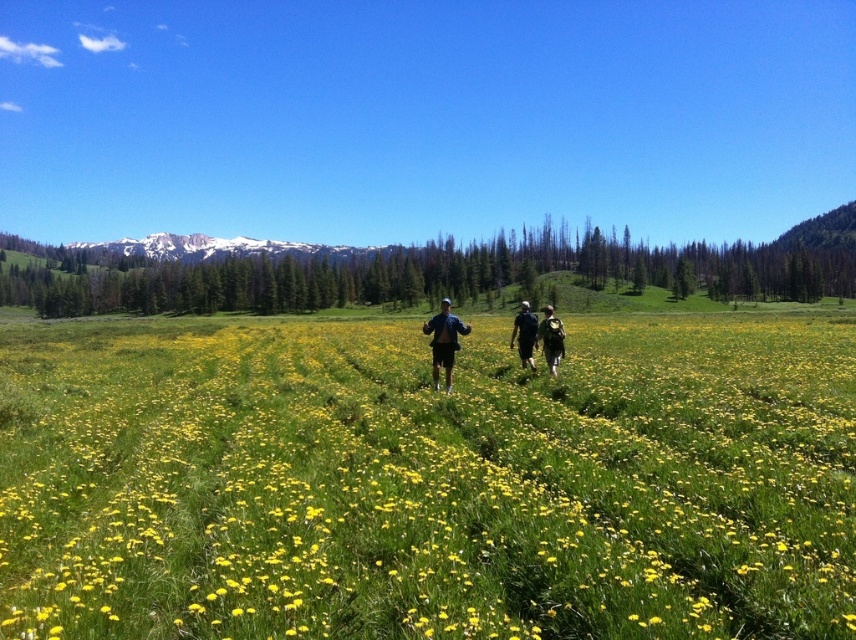
Image resolution: width=856 pixels, height=640 pixels. In order to click on yellow grass at center in this screenshot , I will do `click(428, 481)`.

Is the position of yellow grass at center more distant than that of black fabric backpack at center?

No, it is in front of black fabric backpack at center.

Is point (192, 522) closer to viewer compared to point (519, 332)?

Yes, point (192, 522) is in front of point (519, 332).

What are the coordinates of `yellow grass at center` in the screenshot? It's located at (428, 481).

From the picture: Can you confirm if denim jacket at center is shorter than matte black backpack at center?

No, denim jacket at center is not shorter than matte black backpack at center.

What do you see at coordinates (444, 340) in the screenshot? I see `denim jacket at center` at bounding box center [444, 340].

Where is `denim jacket at center`? denim jacket at center is located at coordinates (444, 340).

Locate an element on the screen. denim jacket at center is located at coordinates (444, 340).

How much distance is there between yellow grass at center and matte black backpacks at center?

yellow grass at center and matte black backpacks at center are 14.33 meters apart.

Can you confirm if yellow grass at center is thinner than matte black backpacks at center?

In fact, yellow grass at center might be wider than matte black backpacks at center.

Locate an element on the screen. Image resolution: width=856 pixels, height=640 pixels. yellow grass at center is located at coordinates (428, 481).

Locate an element on the screen. This screenshot has width=856, height=640. yellow grass at center is located at coordinates (428, 481).